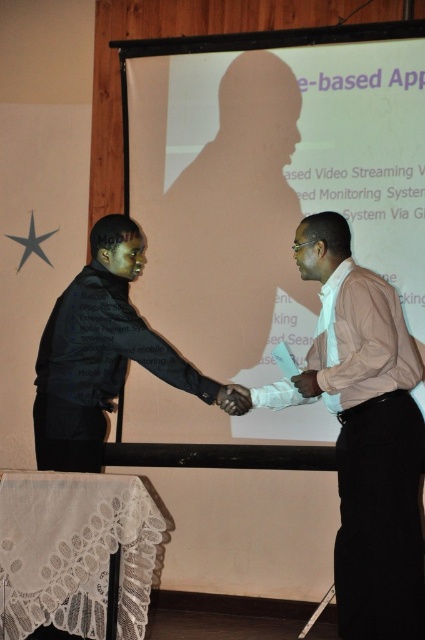
Question: Which point is closer to the camera taking this photo?

Choices:
 (A) (308, 384)
 (B) (246, 410)
 (C) (87, 371)

Answer: (C)

Question: Can you confirm if matte black hand at center is positioned below matte white hand at center?

Choices:
 (A) no
 (B) yes

Answer: (B)

Question: Estimate the real-world distances between objects in this image. Which object is farther from the black matte suit at center?

Choices:
 (A) matte white hand at center
 (B) pink satin shirt at right
 (C) matte black hand at center

Answer: (A)

Question: Which point is farther to the camera?

Choices:
 (A) pink satin shirt at right
 (B) matte white hand at center

Answer: (B)

Question: Does pink satin shirt at right have a greater width compared to matte black hand at center?

Choices:
 (A) no
 (B) yes

Answer: (B)

Question: Can you confirm if black matte suit at center is wider than matte black hand at center?

Choices:
 (A) yes
 (B) no

Answer: (A)